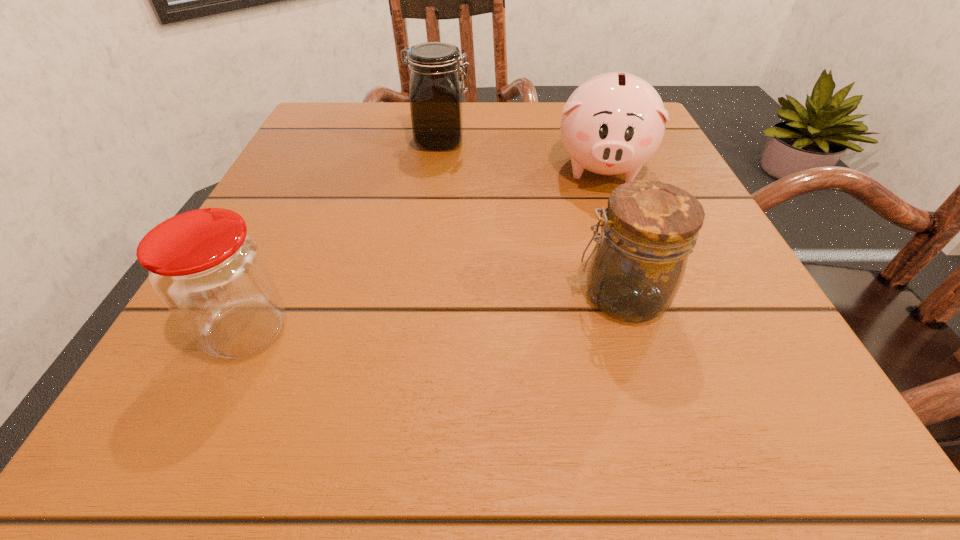
You are a GUI agent. You are given a task and a screenshot of the screen. Output one action in this format:
    pyautogui.click(x=<x>, y=<y>)
    Task: Click on the vacant area situated on the lid of the rightmost jar
    
    Given the screenshot: What is the action you would take?
    pyautogui.click(x=472, y=296)

Where is `jar at the far edge`? The width and height of the screenshot is (960, 540). jar at the far edge is located at coordinates (436, 89).

Where is `piggy bank that is at the far edge`? This screenshot has height=540, width=960. piggy bank that is at the far edge is located at coordinates (613, 123).

Image resolution: width=960 pixels, height=540 pixels. I want to click on object that is at the left edge, so click(x=211, y=274).

You are a GUI agent. You are given a task and a screenshot of the screen. Output one action in this format:
    pyautogui.click(x=<x>, y=<y>)
    Task: Click on the piggy bank positioned at the right edge
    This screenshot has height=540, width=960.
    Given the screenshot: What is the action you would take?
    pyautogui.click(x=613, y=123)

Identify the location of jar located at the right edge. [649, 229].

In order to click on object present at the far right corner in this screenshot , I will do `click(613, 123)`.

At what (x,y) coordinates should I click in order to perform the action: click on vacant area at the far edge. Please return your answer as a coordinate pair (x, y). Image resolution: width=960 pixels, height=540 pixels. Looking at the image, I should click on (497, 108).

The height and width of the screenshot is (540, 960). What are the coordinates of `vacant area at the near edge` in the screenshot? It's located at (330, 419).

What are the coordinates of `vacant space at the left edge of the desktop` in the screenshot? It's located at click(228, 372).